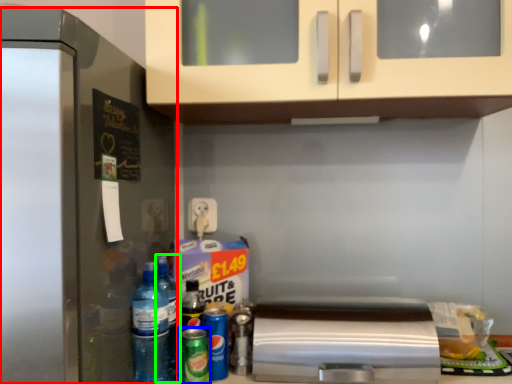
Question: Which object is the closest to the refrigerator (highlighted by a red box)? Choose among these: beer (highlighted by a blue box) or bottle (highlighted by a green box).

Choices:
 (A) beer
 (B) bottle

Answer: (B)